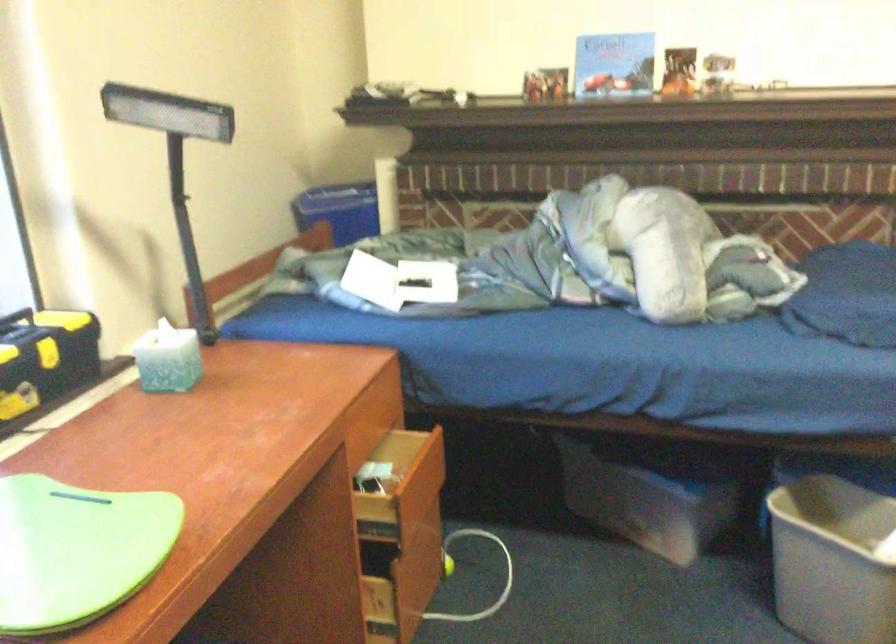
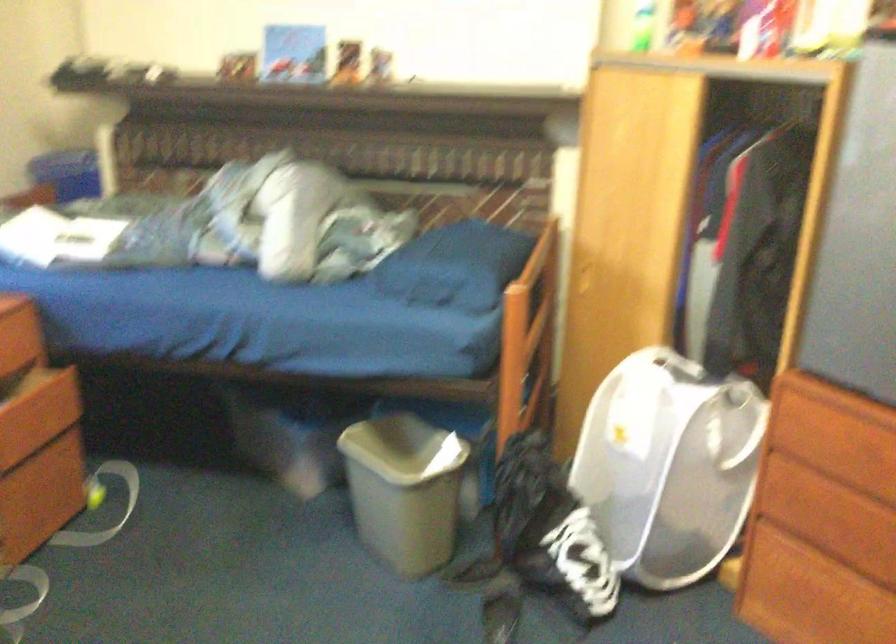
Where in the second image is the point corresponding to (388,397) from the first image?

(19, 332)